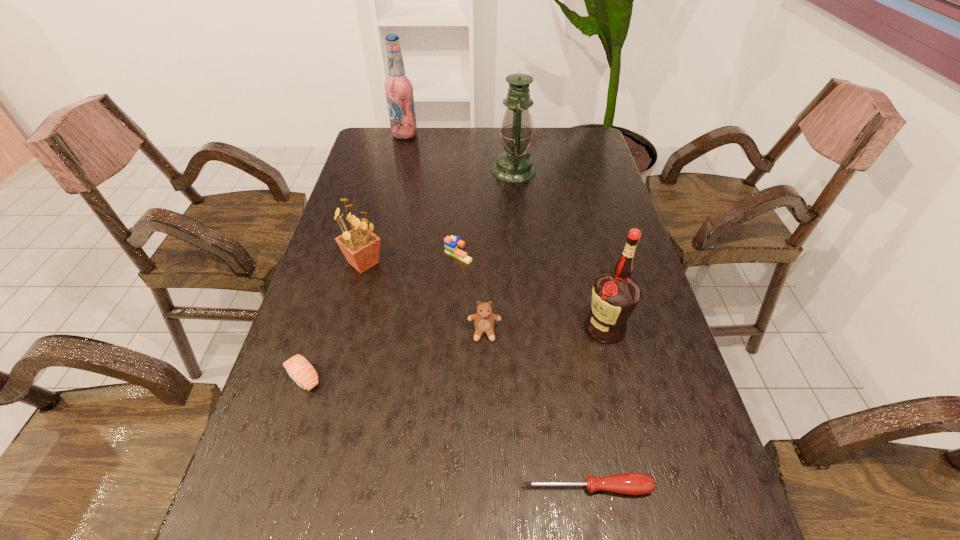
You are a GUI agent. You are given a task and a screenshot of the screen. Output one action in this format:
    pyautogui.click(x=<x>, y=<y>)
    Task: Click on the vacant space in between the right alcohol and the sixth tallest object
    This screenshot has height=540, width=960.
    Given the screenshot: What is the action you would take?
    pyautogui.click(x=532, y=291)

In order to click on empty space that is in between the screwdriver and the sunflower in this screenshot , I will do `click(475, 375)`.

Locate which object ranks fifth in proximity to the nearest object. Please provide its 2D coordinates. Your answer should be formatted as a tuple, i.e. [(x, y)], where the tuple contains the x and y coordinates of a point satisfying the conditions above.

[(360, 246)]

Locate an element on the screen. object that stands as the sixth closest to the sushi is located at coordinates (514, 165).

I want to click on vacant space that satisfies the following two spatial constraints: 1. on the label of the shorter alcohol; 2. on the front side of the sushi, so pyautogui.click(x=617, y=377).